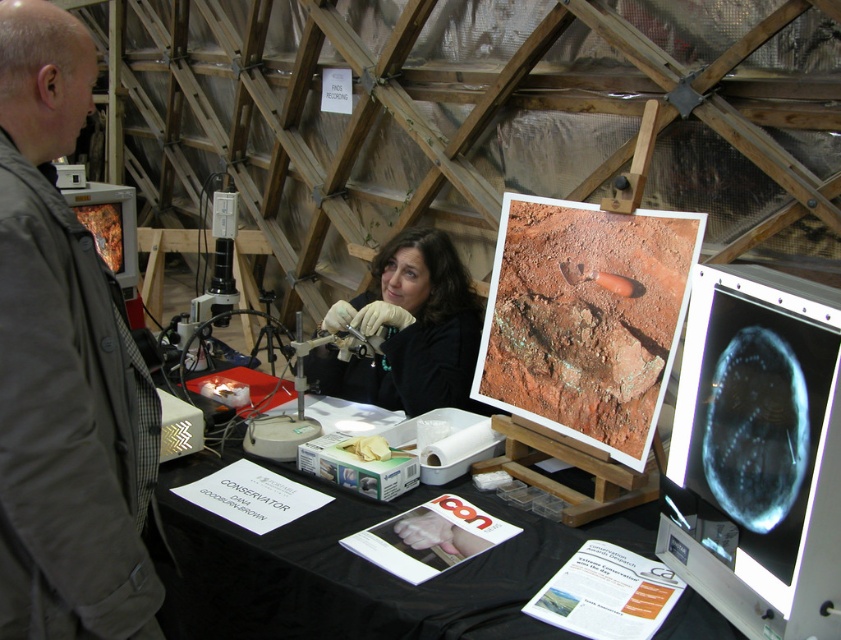
You are an assistant in the workshop and need to place a new document on the surface. Which object, the gray fabric jacket at left or the black paper table at center, would be more appropriate for placing the document?

The black paper table at center is more appropriate for placing the document because the gray fabric jacket at left has a lesser width, making it less stable or suitable for holding items compared to the larger surface area of the table.

What is the object located at the coordinates point (x=61, y=364) in the image?

The object at point (x=61, y=364) is on a gray fabric jacket at left.

What is the exact location of the gray fabric jacket at left in the image?

The gray fabric jacket at left is located at point (61, 364).